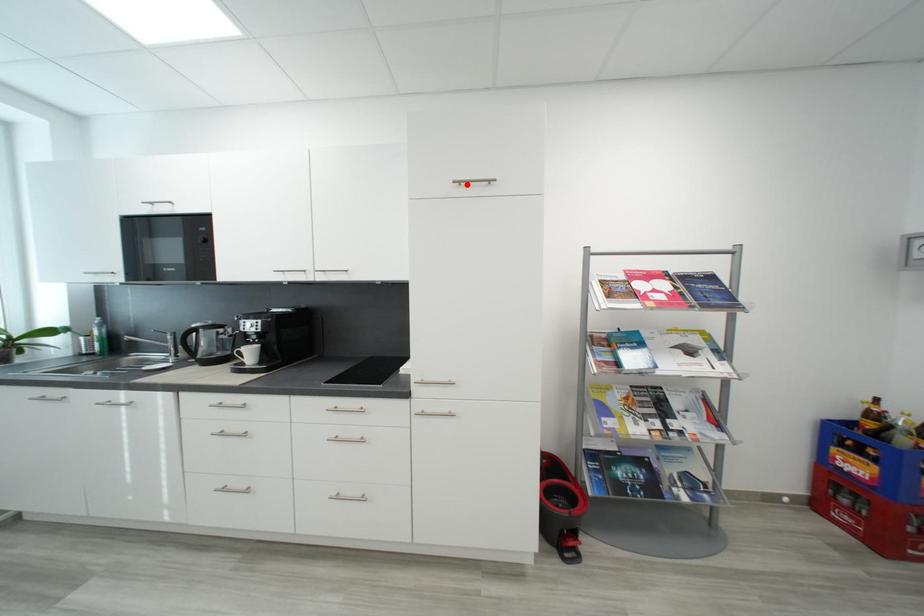
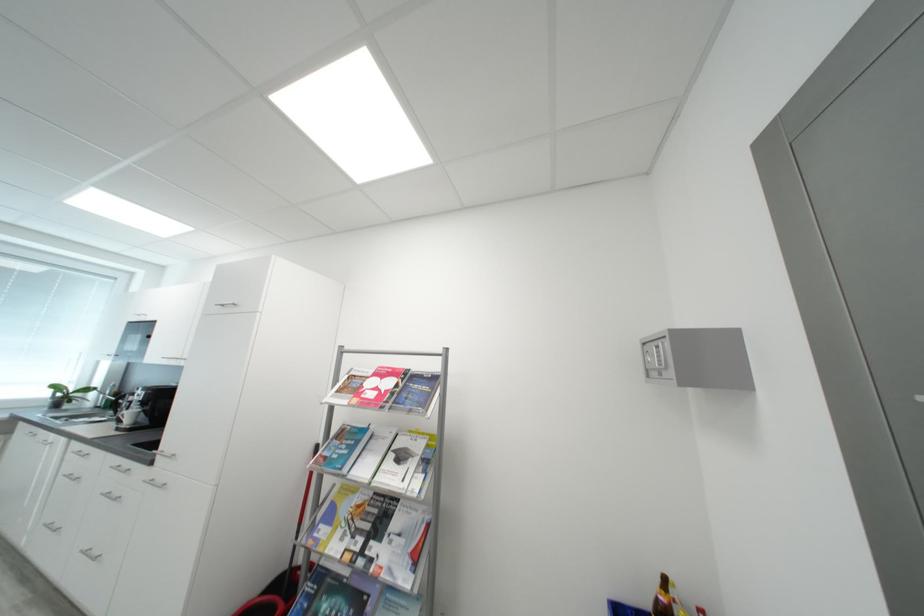
Where in the second image is the point corresponding to the highlighted location from the first image?

(228, 307)